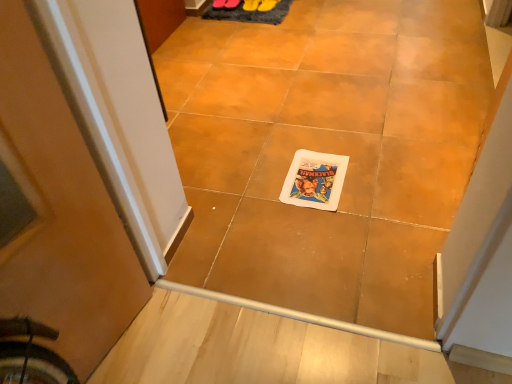
Question: Is rubber yellow shoe at upper center, which is the second footwear in left-to-right order, closer to the viewer compared to matte paper comic book at center?

Choices:
 (A) yes
 (B) no

Answer: (B)

Question: Is rubber yellow shoe at upper center, the 1th footwear when ordered from right to left, thinner than matte paper comic book at center?

Choices:
 (A) no
 (B) yes

Answer: (B)

Question: Is rubber yellow shoe at upper center, which is the second footwear in left-to-right order, not inside matte paper comic book at center?

Choices:
 (A) no
 (B) yes

Answer: (B)

Question: Is rubber yellow shoe at upper center, which is the second footwear in left-to-right order, aimed at matte paper comic book at center?

Choices:
 (A) no
 (B) yes

Answer: (A)

Question: Considering the relative positions of rubber yellow shoe at upper center, which is the second footwear in left-to-right order, and matte paper comic book at center in the image provided, is rubber yellow shoe at upper center, which is the second footwear in left-to-right order, to the right of matte paper comic book at center from the viewer's perspective?

Choices:
 (A) yes
 (B) no

Answer: (B)

Question: Considering their positions, is rubber yellow shoe at upper center, which is the second footwear in left-to-right order, located in front of or behind yellow rubber boot at center, which is counted as the second footwear, starting from the right?

Choices:
 (A) front
 (B) behind

Answer: (A)

Question: Is rubber yellow shoe at upper center, the 1th footwear when ordered from right to left, to the left or to the right of yellow rubber boot at center, which is counted as the second footwear, starting from the right, in the image?

Choices:
 (A) left
 (B) right

Answer: (B)

Question: Would you say rubber yellow shoe at upper center, which is the second footwear in left-to-right order, is inside or outside yellow rubber boot at center, the 1th footwear viewed from the left?

Choices:
 (A) inside
 (B) outside

Answer: (B)

Question: In terms of height, does rubber yellow shoe at upper center, which is the second footwear in left-to-right order, look taller or shorter compared to yellow rubber boot at center, the 1th footwear viewed from the left?

Choices:
 (A) short
 (B) tall

Answer: (A)

Question: From a real-world perspective, is yellow rubber boot at center, which is counted as the second footwear, starting from the right, above or below rubber yellow shoe at upper center, which is the second footwear in left-to-right order?

Choices:
 (A) below
 (B) above

Answer: (A)

Question: Is yellow rubber boot at center, the 1th footwear viewed from the left, inside the boundaries of rubber yellow shoe at upper center, the 1th footwear when ordered from right to left, or outside?

Choices:
 (A) inside
 (B) outside

Answer: (B)

Question: Considering their positions, is yellow rubber boot at center, the 1th footwear viewed from the left, located in front of or behind rubber yellow shoe at upper center, the 1th footwear when ordered from right to left?

Choices:
 (A) front
 (B) behind

Answer: (B)

Question: Considering the relative positions of yellow rubber boot at center, the 1th footwear viewed from the left, and rubber yellow shoe at upper center, which is the second footwear in left-to-right order, in the image provided, is yellow rubber boot at center, the 1th footwear viewed from the left, to the left or to the right of rubber yellow shoe at upper center, which is the second footwear in left-to-right order,?

Choices:
 (A) right
 (B) left

Answer: (B)

Question: Does point (252, 8) appear closer or farther from the camera than point (244, 13)?

Choices:
 (A) closer
 (B) farther

Answer: (A)

Question: Considering the positions of yellow rubber boot at center, which is counted as the second footwear, starting from the right, and dark gray shaggy rug at upper center in the image, is yellow rubber boot at center, which is counted as the second footwear, starting from the right, wider or thinner than dark gray shaggy rug at upper center?

Choices:
 (A) thin
 (B) wide

Answer: (A)